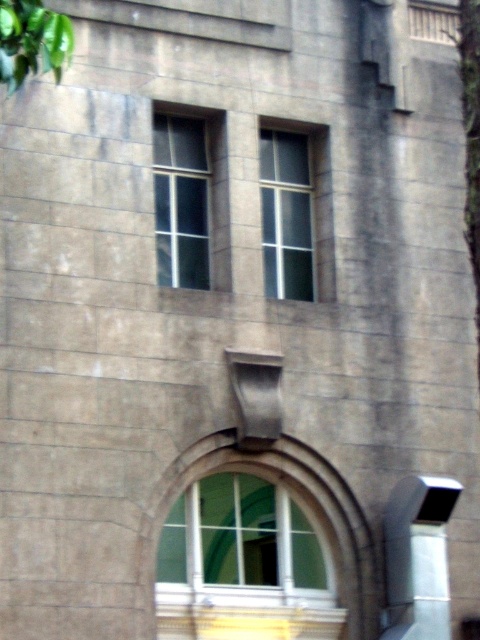
You are standing at the camera position looking at the building. Is the point at coordinates (173, 573) on the building wall within your field of view?

The point at coordinates (173, 573) is 145.38 feet away from the camera. Since the camera is positioned to view the building wall, the point is likely within the field of view as it is part of the described wall features.

You are standing in front of the building and want to take a photo. You notice two points on the wall marked as point 1 and point 2. If point 1 is at coordinate (323, 282) and point 2 is at (40, 38), which point is closer to your camera lens?

Point 1 at coordinate (323, 282) is further to the camera than point 2 at (40, 38), so point 2 is closer to the camera lens.

You are standing outside the building and want to know if the clear glass window at center is positioned above or below the green leafy tree at upper left. Based on the scene description, what is the relationship between their positions?

The clear glass window at center is located below the green leafy tree at upper left, so it is positioned below the tree.